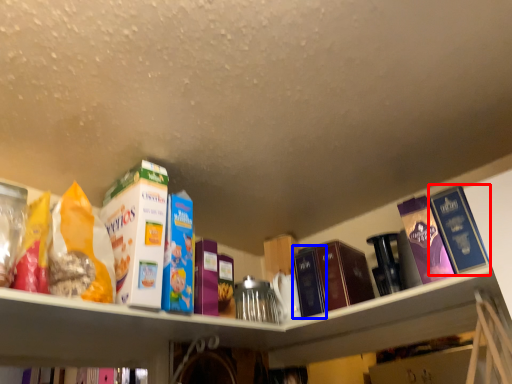
Question: Which of the following is the farthest to the observer, book (highlighted by a red box) or book (highlighted by a blue box)?

Choices:
 (A) book
 (B) book

Answer: (B)